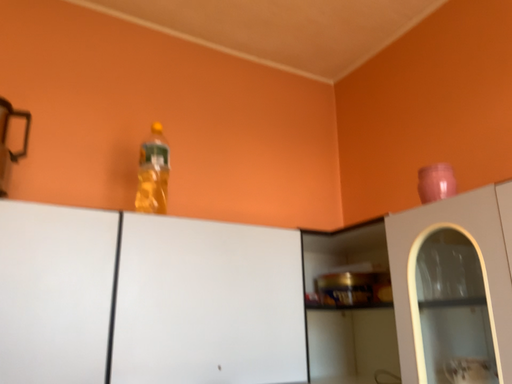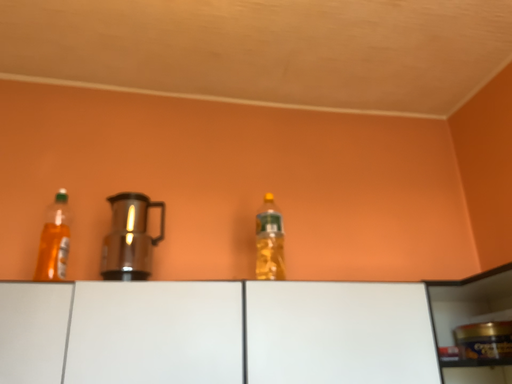
Question: How did the camera likely rotate when shooting the video?

Choices:
 (A) rotated left
 (B) rotated right

Answer: (A)